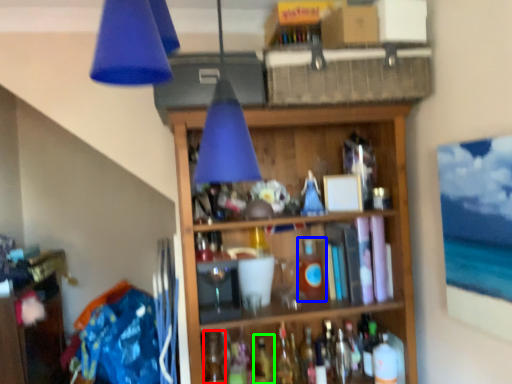
Question: Considering the real-world distances, which object is farthest from bottle (highlighted by a red box)? bottle (highlighted by a blue box) or wine bottle (highlighted by a green box)?

Choices:
 (A) bottle
 (B) wine bottle

Answer: (A)